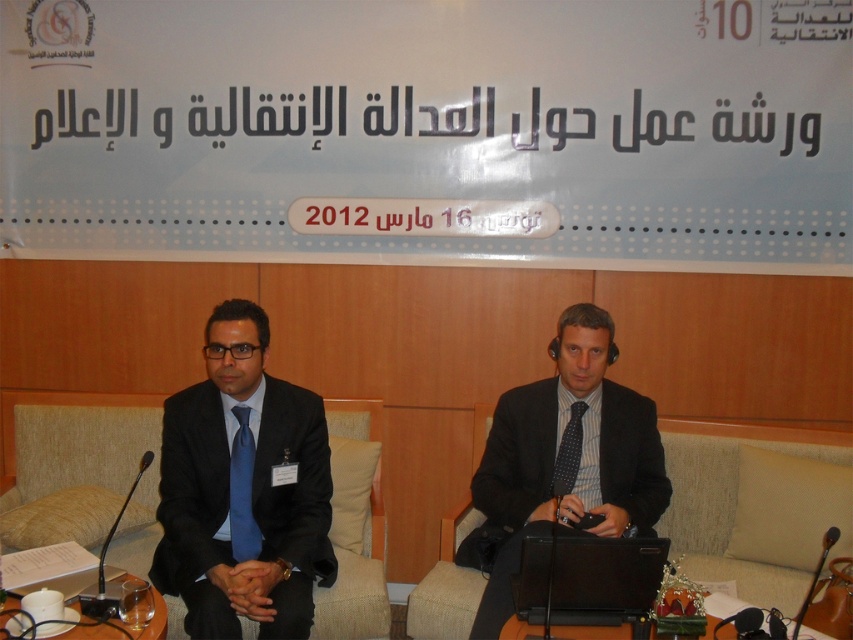
You are a photographer standing at the front of the room where the beige fabric couch at center is located. You want to take a photo of the two men seated on the couch without any obstructions. Since the couch is 2.67 meters away from you, what is the minimum focal length lens you should use if your camera has a sensor size of 36mm x 24mm and you want the entire scene to be in focus?

The minimum focal length lens required would depend on the desired field of view and depth of field. However, given the distance of 2.67 meters, a standard lens around 50mm might suffice for capturing the two men on the beige fabric couch at center without obstructions, ensuring the entire scene is in focus.

You are a photographer at the event and need to capture a closeup of the blue silk tie at center without the translucent glass table at lower left appearing in the frame. Is the tie small enough to fit within the camera frame without including the table?

The blue silk tie at center is narrower than the translucent glass table at lower left, so it can be framed without including the table.

You are an attendee at the workshop and want to know which of the two points, point (236,442) or point (68,604), is closer to you. Which one is closer?

Point (236,442) is closer to you than point (68,604) because it is further to the viewer.